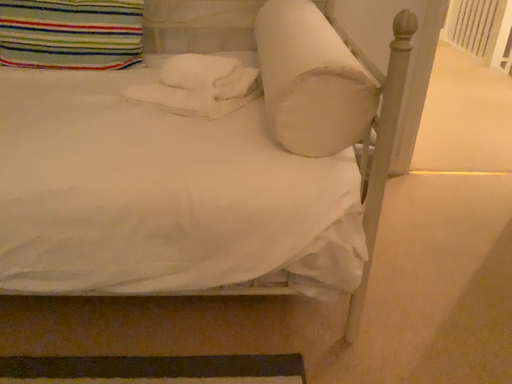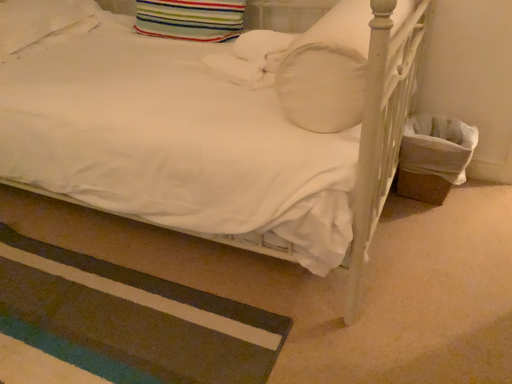
Question: Which way did the camera rotate in the video?

Choices:
 (A) rotated left
 (B) rotated right

Answer: (A)